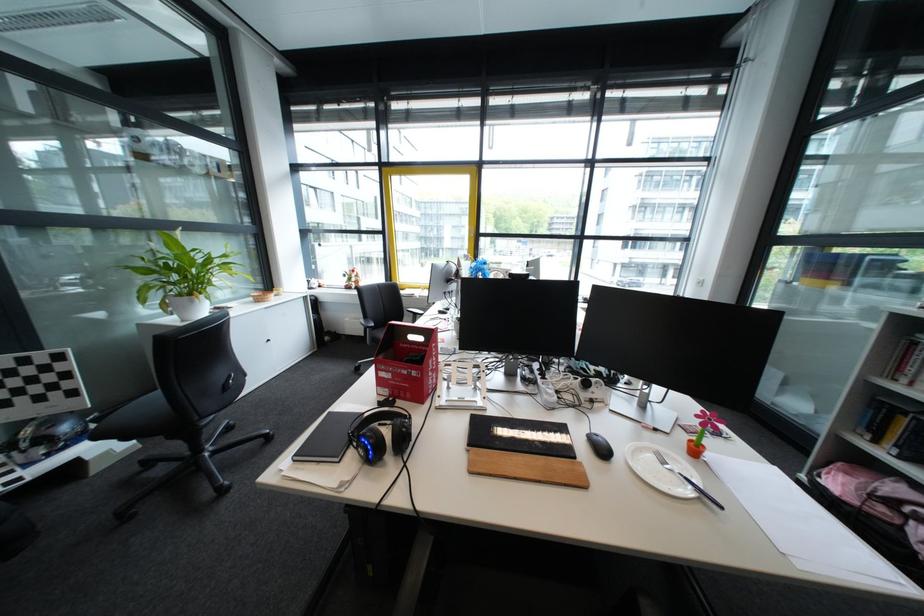
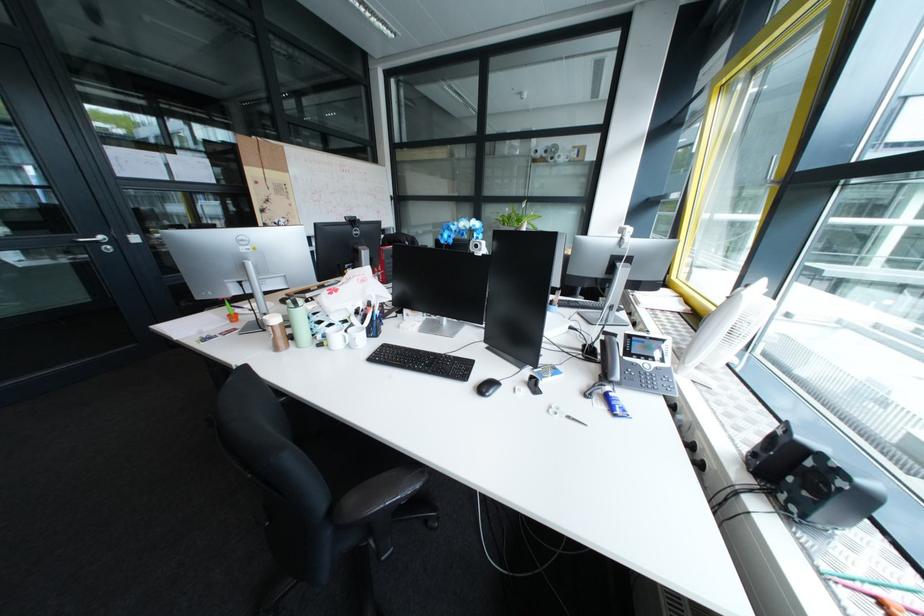
Question: I am providing you with two images of the same scene from different viewpoints. After the viewpoint changes to image2, which objects are now occluded?

Choices:
 (A) white mug handle
 (B) black notebook
 (C) red round potholder
 (D) brown shaker cup

Answer: (B)